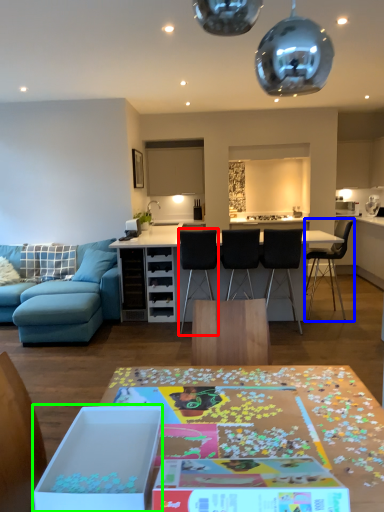
Question: Based on their relative distances, which object is farther from chair (highlighted by a red box)? Choose from chair (highlighted by a blue box) and cardboard box (highlighted by a green box).

Choices:
 (A) chair
 (B) cardboard box

Answer: (B)